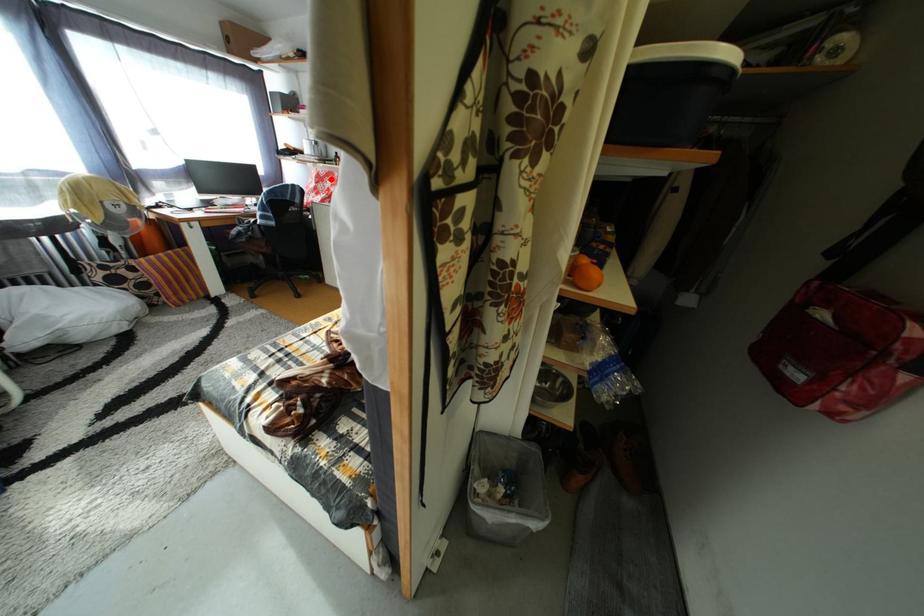
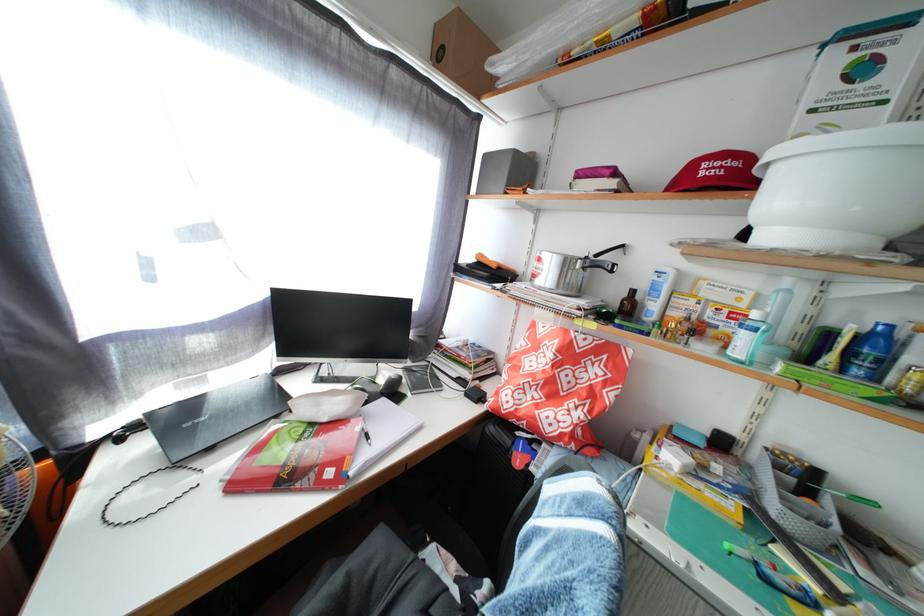
Locate, in the second image, the point that corresponds to the highlighted location in the first image.

(590, 350)